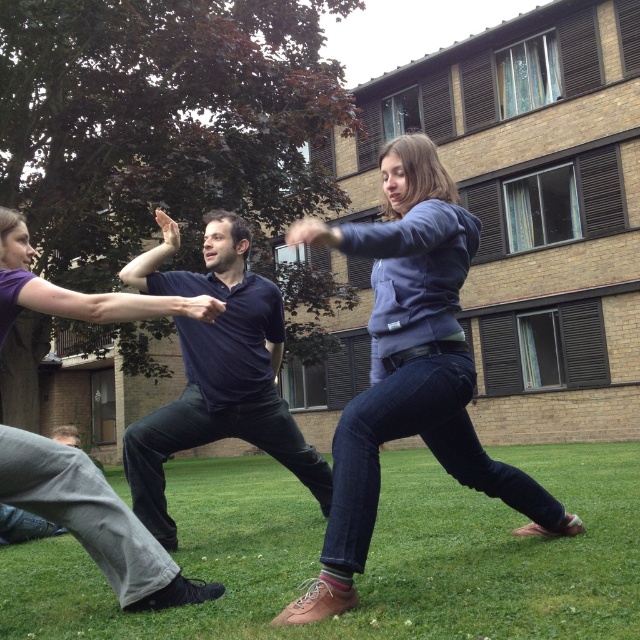
You are a photographer trying to capture a group photo of the matte blue hoodie at center and the matte purple shirt at center. You want to ensure both are fully visible in the frame. Based on their current positions, which subject should you position closer to the camera to avoid cropping either of them?

You should position the matte purple shirt at center closer to the camera because the matte blue hoodie at center might be wider than the matte purple shirt at center, so moving the narrower one forward ensures both fit within the frame without cropping.

You are a photographer trying to capture a group photo of the dark blue shirt at center and the matte purple shirt at center. Which person should you position closer to the camera to ensure both appear equally sized in the photo?

Since the dark blue shirt at center is wider than the matte purple shirt at center, you should position the matte purple shirt at center closer to the camera to make them appear the same size in the photo.